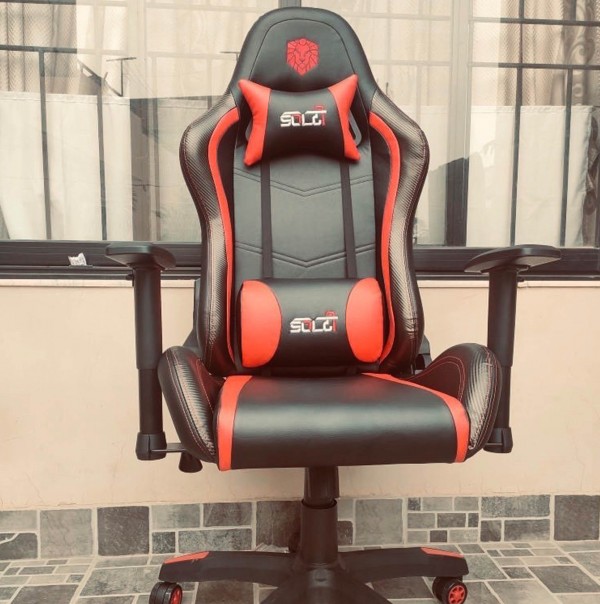
At what (x,y) coordinates should I click in order to perform the action: click on pillow. Please return your answer as a coordinate pair (x, y). Looking at the image, I should click on click(x=298, y=106), click(x=319, y=345).